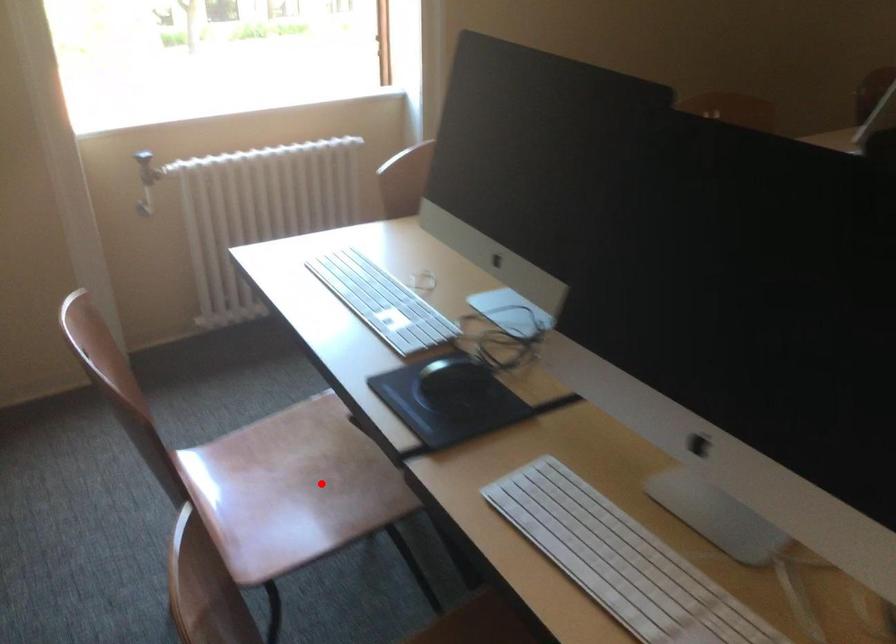
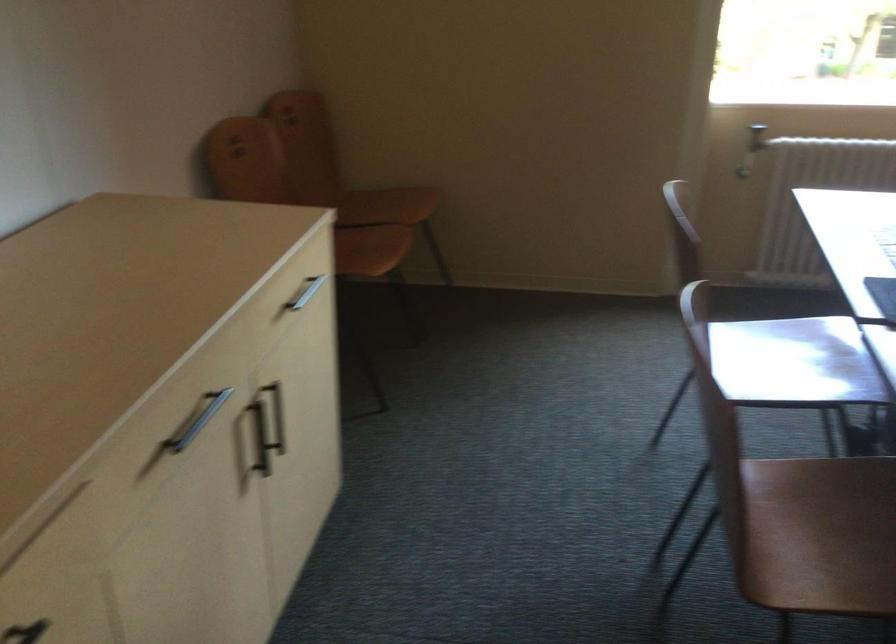
Locate, in the second image, the point that corresponds to the highlighted location in the first image.

(794, 362)